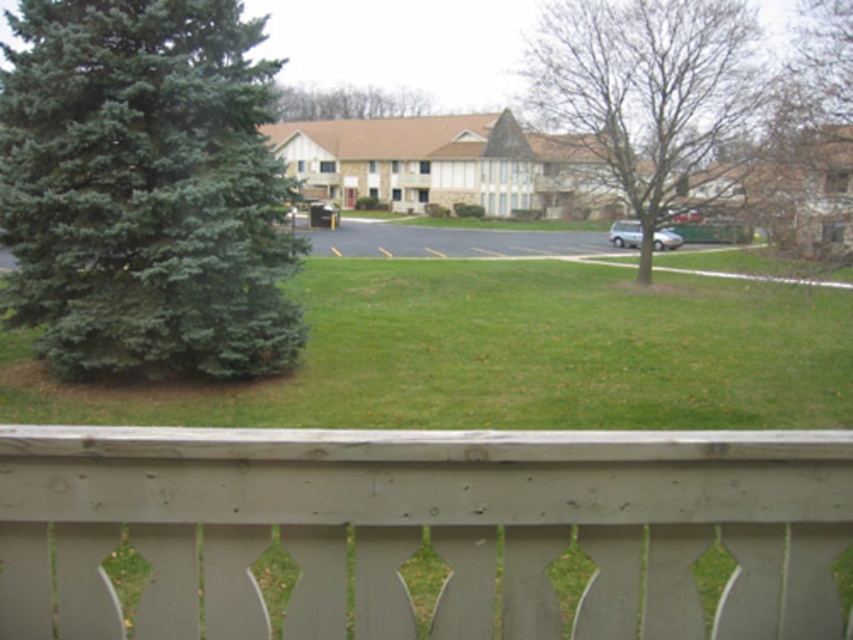
You are standing behind the wooden fence and want to take a photo of both the green matte evergreen tree at left and the green leafy tree at upper center. Which tree will appear larger in the photo?

The green matte evergreen tree at left will appear larger in the photo because it is closer to the viewer than the green leafy tree at upper center.

You are standing behind the wooden fence and want to know which tree is taller between the green matte evergreen tree at left and the green leafy tree at upper center. Can you determine this based on the scene?

The green leafy tree at upper center is taller than the green matte evergreen tree at left.

You are standing in a residential area and want to take a photo of the green matte evergreen tree at left without the gray wood fence at lower center blocking the view. Which direction should you move to achieve this?

Move to the right side of the gray wood fence at lower center so that it is no longer between you and the green matte evergreen tree at left.